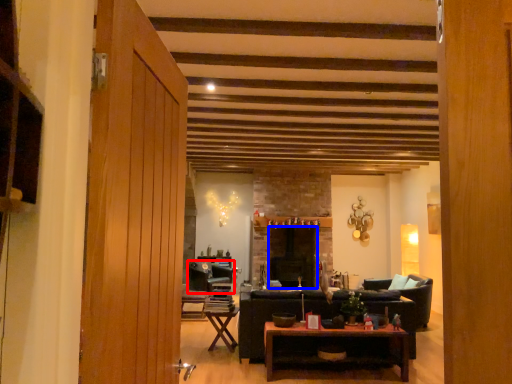
Question: Among these objects, which one is farthest to the camera, chair (highlighted by a red box) or fireplace (highlighted by a blue box)?

Choices:
 (A) chair
 (B) fireplace

Answer: (B)